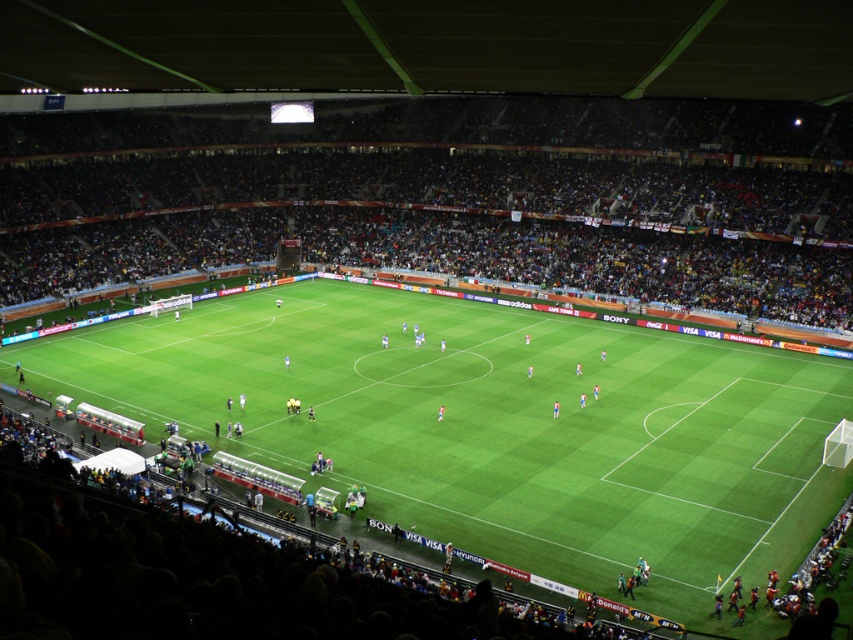
You are a spectator sitting in the dark brown stadium seats at center. Looking towards the green grass football field at center, which direction should you look to see the field?

The green grass football field at center is to the right of the dark brown stadium seats at center, so you should look to your right to see the field.

You are a drone operator trying to capture aerial footage of the soccer match. You have two points marked on your screen corresponding to locations on the field. The first point is at coordinates point (x=231, y=385), and the second is at point (x=703, y=150). If you want to film the part of the field closest to the camera, which point should you focus on?

Point (x=231, y=385) is closer to the viewer than point (x=703, y=150), so you should focus on point (x=231, y=385) to capture the part of the field closest to the camera.

You are a drone operator trying to capture aerial footage of the soccer match. Your drone has a camera with a 1.2 meter wide lens. You need to frame both the green grass football field at center and the dark brown stadium seats at center in the same shot. Which object should you prioritize to ensure it fits within the camera lens width?

The green grass football field at center is thinner than the dark brown stadium seats at center, so you should prioritize framing the dark brown stadium seats at center since it is wider and requires more space to fit within the camera lens width.